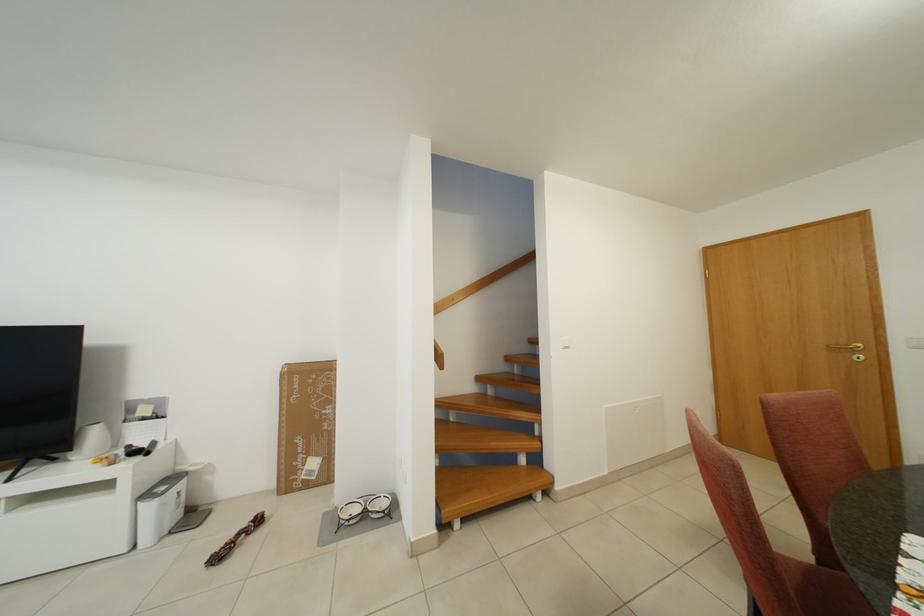
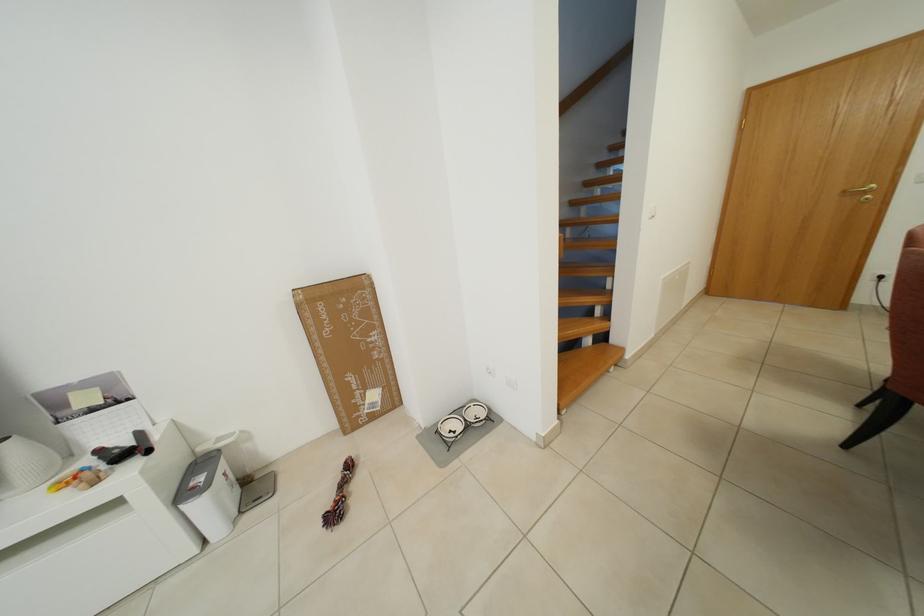
Find the pixel in the second image that matches point (138, 451) in the first image.

(108, 455)